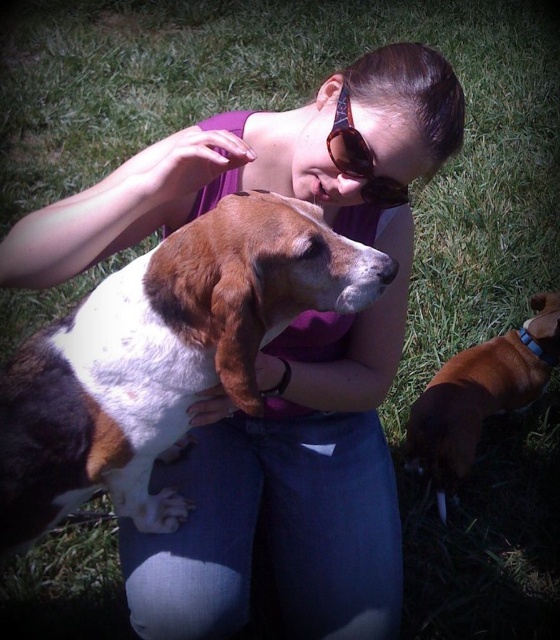
You are a photographer trying to capture a closeup of the sunglasses at center while also including the brown smooth dog at lower right in the frame. Based on their sizes, do you think the dog will appear larger or smaller in the photo compared to the sunglasses?

The brown smooth dog at lower right has a greater height compared to sunglasses at center, so the dog will appear larger in the photo than the sunglasses.

From the picture: You are a photographer trying to capture the woman and the dogs in the scene. You notice the brown and white fur dog at center and the sunglasses at center. Which object is located more to the left in the image?

The brown and white fur dog at center is positioned on the left side of sunglasses at center, so it is more to the left.

You are standing at the camera position and want to know how far the point at coordinates (557,340) is from you. Can you determine the distance in feet?

The point at coordinates (557,340) is 7.19 feet away from the camera position.